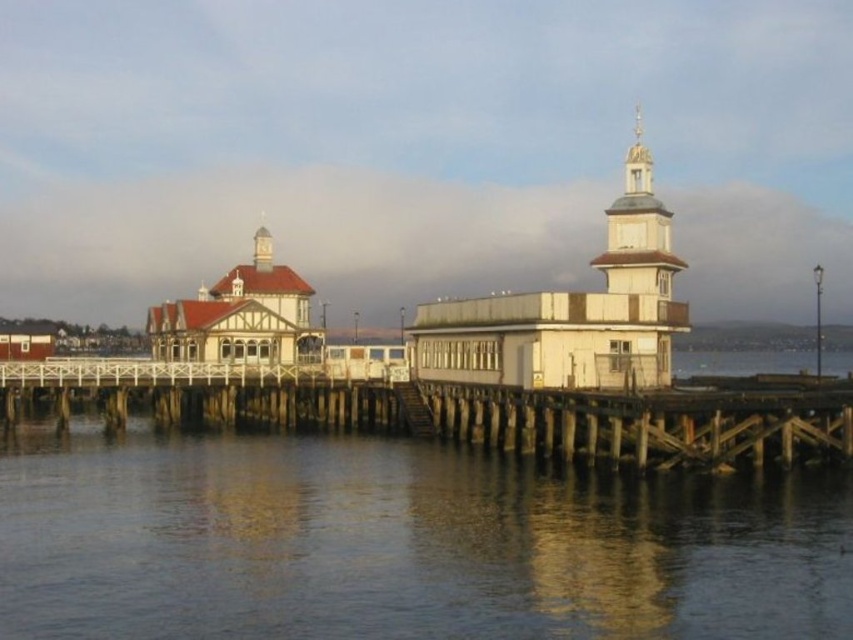
Which of these two, transparent water at lower center or wooden spire at upper center, stands shorter?

transparent water at lower center is shorter.

Which is more to the left, transparent water at lower center or wooden spire at upper center?

From the viewer's perspective, wooden spire at upper center appears more on the left side.

At what (x,y) coordinates should I click in order to perform the action: click on transparent water at lower center. Please return your answer as a coordinate pair (x, y). Looking at the image, I should click on (402, 541).

Is wooden at lower center smaller than wooden spire at upper center?

Incorrect, wooden at lower center is not smaller in size than wooden spire at upper center.

Does wooden at lower center appear on the left side of wooden spire at upper center?

In fact, wooden at lower center is to the right of wooden spire at upper center.

Between point (47, 380) and point (254, 252), which one is positioned in front?

Positioned in front is point (47, 380).

The image size is (853, 640). I want to click on wooden at lower center, so click(x=479, y=413).

Based on the photo, can you confirm if white wooden tower at center is positioned below wooden spire at upper center?

No.

I want to click on white wooden tower at center, so click(x=572, y=310).